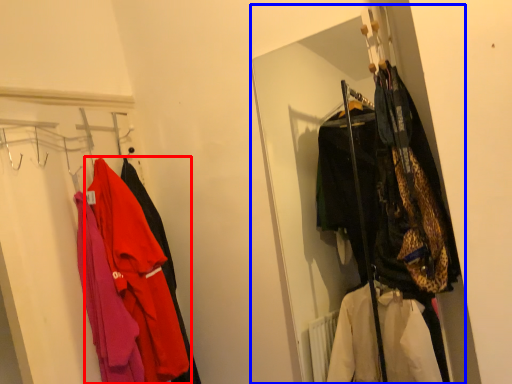
Question: Which object is closer to the camera taking this photo, jacket (highlighted by a red box) or closet (highlighted by a blue box)?

Choices:
 (A) jacket
 (B) closet

Answer: (B)